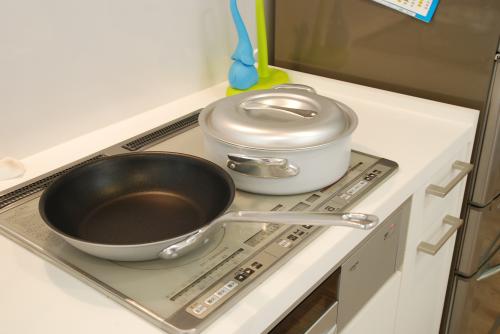
Where is `tan handle of drawer`? The width and height of the screenshot is (500, 334). tan handle of drawer is located at coordinates [443, 189].